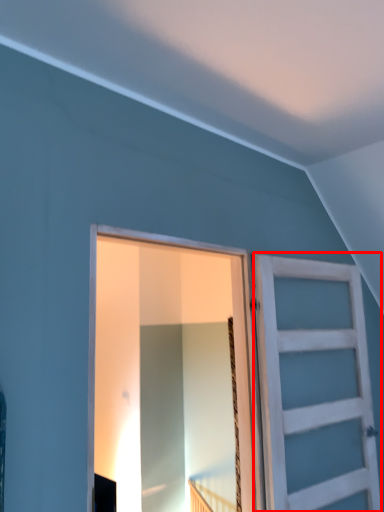
Question: Where is barn door (annotated by the red box) located in relation to barn door in the image?

Choices:
 (A) left
 (B) right

Answer: (B)